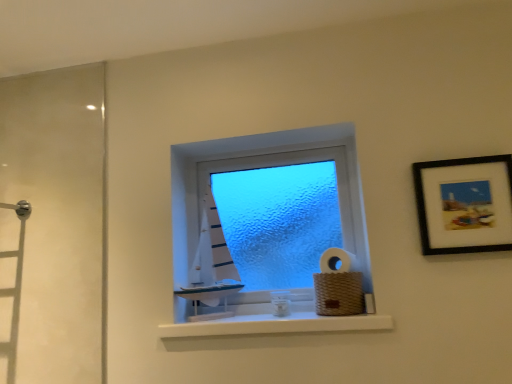
Question: Is white matte sailboat at center beside woven brown basket at lower right, which ranks as the 2th toilet paper in top-to-bottom order?

Choices:
 (A) yes
 (B) no

Answer: (B)

Question: From the image's perspective, does white matte sailboat at center appear higher than woven brown basket at lower right, which ranks as the 2th toilet paper in top-to-bottom order?

Choices:
 (A) yes
 (B) no

Answer: (A)

Question: Is woven brown basket at lower right, positioned as the first toilet paper in bottom-to-top order, at the back of white matte sailboat at center?

Choices:
 (A) no
 (B) yes

Answer: (A)

Question: From the image's perspective, is white matte sailboat at center beneath woven brown basket at lower right, which ranks as the 2th toilet paper in top-to-bottom order?

Choices:
 (A) no
 (B) yes

Answer: (A)

Question: Is white matte sailboat at center positioned beyond the bounds of woven brown basket at lower right, which ranks as the 2th toilet paper in top-to-bottom order?

Choices:
 (A) no
 (B) yes

Answer: (B)

Question: From a real-world perspective, is white matte sailboat at center physically below woven brown basket at lower right, positioned as the first toilet paper in bottom-to-top order?

Choices:
 (A) yes
 (B) no

Answer: (B)

Question: Can you confirm if white matte sailboat at center is shorter than black matte picture frame at upper right?

Choices:
 (A) no
 (B) yes

Answer: (A)

Question: Considering the relative sizes of white matte sailboat at center and black matte picture frame at upper right in the image provided, is white matte sailboat at center thinner than black matte picture frame at upper right?

Choices:
 (A) no
 (B) yes

Answer: (A)

Question: From a real-world perspective, is white matte sailboat at center located higher than black matte picture frame at upper right?

Choices:
 (A) yes
 (B) no

Answer: (B)

Question: From a real-world perspective, is white matte sailboat at center physically below black matte picture frame at upper right?

Choices:
 (A) no
 (B) yes

Answer: (B)

Question: Is white matte sailboat at center at the left side of black matte picture frame at upper right?

Choices:
 (A) yes
 (B) no

Answer: (A)

Question: Considering the relative sizes of white matte sailboat at center and black matte picture frame at upper right in the image provided, is white matte sailboat at center taller than black matte picture frame at upper right?

Choices:
 (A) no
 (B) yes

Answer: (B)

Question: From a real-world perspective, is white matte sailboat at center located higher than white matte window sill at center?

Choices:
 (A) no
 (B) yes

Answer: (B)